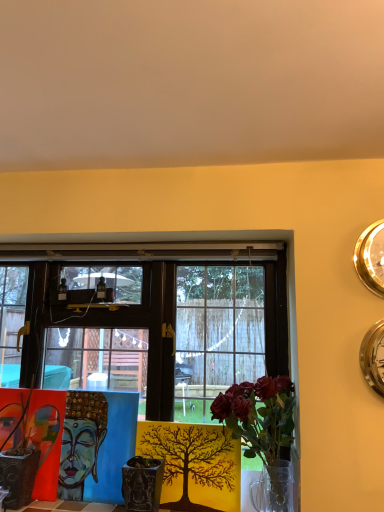
Question: Is silver metallic clock at upper right, which is the first clock in bottom-to-top order, taller than translucent glass vase at center?

Choices:
 (A) yes
 (B) no

Answer: (B)

Question: From the image's perspective, is silver metallic clock at upper right, the second clock positioned from the top, over translucent glass vase at center?

Choices:
 (A) yes
 (B) no

Answer: (A)

Question: Are silver metallic clock at upper right, which is the first clock in bottom-to-top order, and translucent glass vase at center beside each other?

Choices:
 (A) no
 (B) yes

Answer: (A)

Question: Can you confirm if silver metallic clock at upper right, which is the first clock in bottom-to-top order, is wider than translucent glass vase at center?

Choices:
 (A) no
 (B) yes

Answer: (A)

Question: Is silver metallic clock at upper right, the second clock positioned from the top, at the right side of translucent glass vase at center?

Choices:
 (A) yes
 (B) no

Answer: (A)

Question: From a real-world perspective, is silver metallic clock at upper right, which is the first clock in bottom-to-top order, located higher than translucent glass vase at center?

Choices:
 (A) no
 (B) yes

Answer: (B)

Question: Is wooden table at center wider than textured ceramic pot at center?

Choices:
 (A) no
 (B) yes

Answer: (A)

Question: Is wooden table at center turned away from textured ceramic pot at center?

Choices:
 (A) no
 (B) yes

Answer: (A)

Question: Can you confirm if wooden table at center is thinner than textured ceramic pot at center?

Choices:
 (A) no
 (B) yes

Answer: (B)

Question: From the image's perspective, is wooden table at center beneath textured ceramic pot at center?

Choices:
 (A) no
 (B) yes

Answer: (A)

Question: Does wooden table at center turn towards textured ceramic pot at center?

Choices:
 (A) yes
 (B) no

Answer: (B)

Question: Is wooden table at center positioned in front of textured ceramic pot at center?

Choices:
 (A) yes
 (B) no

Answer: (B)

Question: Does gold metallic clock at upper right, placed as the first clock when sorted from top to bottom, have a lesser height compared to silver metallic clock at upper right, which is the first clock in bottom-to-top order?

Choices:
 (A) no
 (B) yes

Answer: (B)